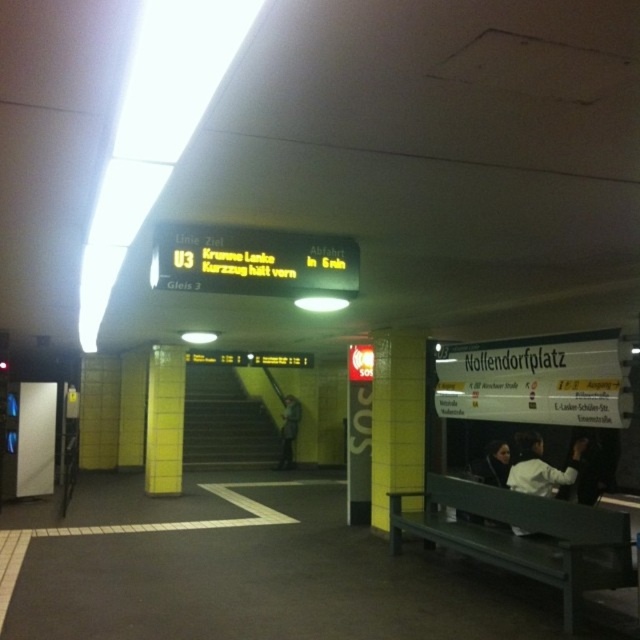
You are standing at the entrance of the underground station and see two points marked on the floor in front of you. The first point is labeled as point (544,477) and the second is point (492,458). If you want to walk towards the bench on the right side, which point should you step on first?

You should step on point (544,477) first because it is in front of point (492,458), meaning it is closer to your current position at the entrance and aligns with the direction towards the bench on the right side.

You are a commuter carrying a backpack and need to sit on the bench at the lower right. There are two jackets, the white matte jacket at lower right and the dark gray jacket at center. Which jacket is closer to the bench where you want to sit?

The white matte jacket at lower right is closer to the bench where you want to sit because it is located at the lower right, which is the same position as the bench.